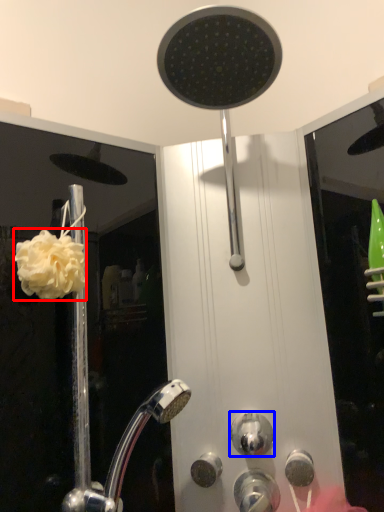
Question: Which object is closer to the camera taking this photo, flower (highlighted by a red box) or knob (highlighted by a blue box)?

Choices:
 (A) flower
 (B) knob

Answer: (A)